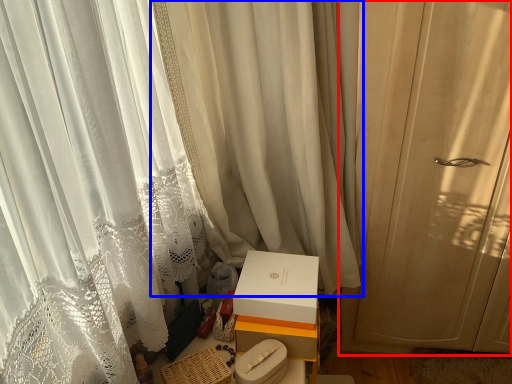
Question: Which object appears farthest to the camera in this image, curtain (highlighted by a red box) or curtain (highlighted by a blue box)?

Choices:
 (A) curtain
 (B) curtain

Answer: (A)